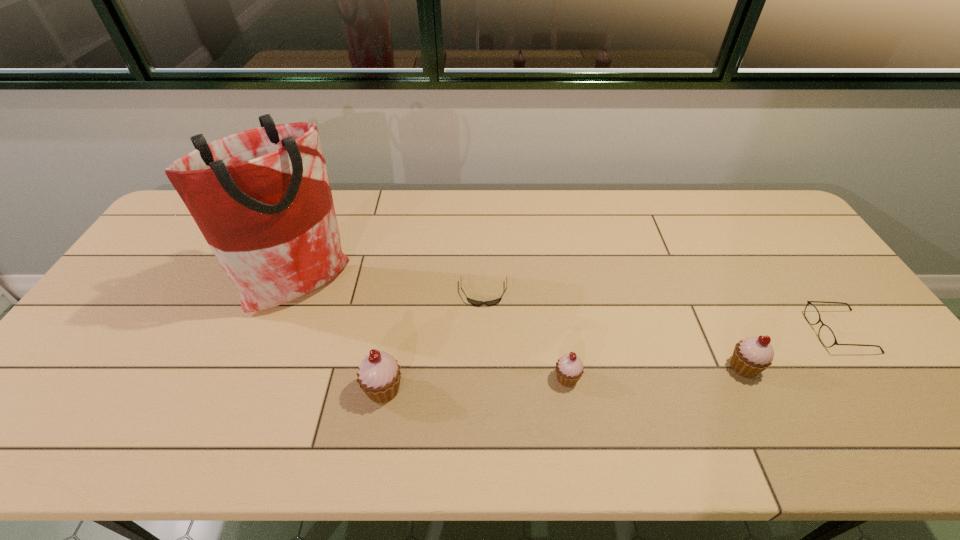
At what (x,y) coordinates should I click in order to perform the action: click on the fifth object from right to left. Please return your answer as a coordinate pair (x, y). This screenshot has height=540, width=960. Looking at the image, I should click on (379, 375).

Locate an element on the screen. The image size is (960, 540). the tallest cupcake is located at coordinates (x=379, y=375).

This screenshot has width=960, height=540. What are the coordinates of `the shortest cupcake` in the screenshot? It's located at pyautogui.click(x=569, y=369).

At what (x,y) coordinates should I click in order to perform the action: click on the second cupcake from left to right. Please return your answer as a coordinate pair (x, y). Looking at the image, I should click on (569, 369).

Where is `the second shortest cupcake`? This screenshot has width=960, height=540. the second shortest cupcake is located at coordinates (751, 356).

The height and width of the screenshot is (540, 960). I want to click on the second object from right to left, so click(x=751, y=356).

This screenshot has height=540, width=960. Find the location of `the tallest object`. the tallest object is located at coordinates (262, 199).

This screenshot has width=960, height=540. I want to click on grocery bag, so click(262, 199).

Where is `the fourth object from right to left`? The width and height of the screenshot is (960, 540). the fourth object from right to left is located at coordinates (477, 303).

At what (x,y) coordinates should I click in order to perform the action: click on the shortest object. Please return your answer as a coordinate pair (x, y). The width and height of the screenshot is (960, 540). Looking at the image, I should click on (477, 303).